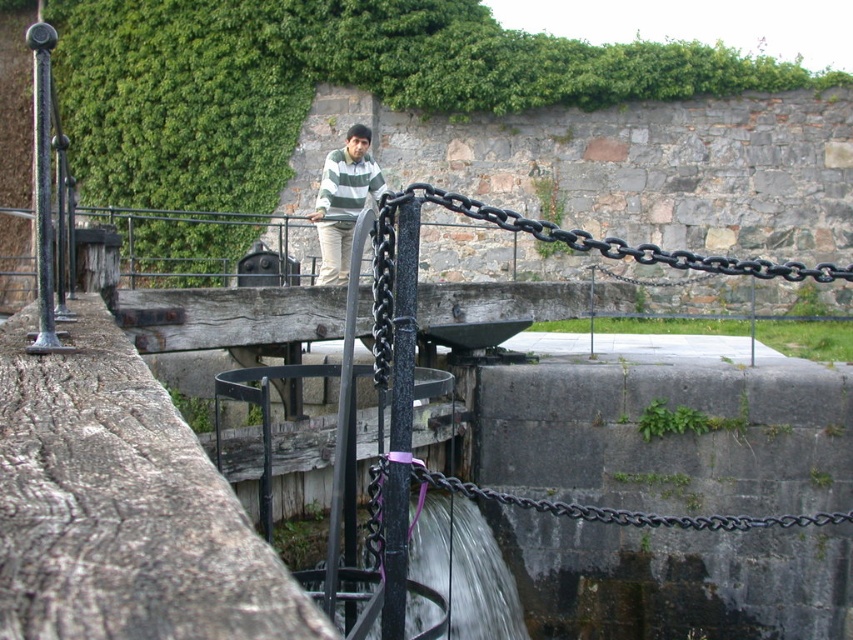
Between black metal chain at upper center and striped sweater at center, which one has more height?

black metal chain at upper center

Does black metal chain at upper center appear over striped sweater at center?

Actually, black metal chain at upper center is below striped sweater at center.

Which is in front, point (660, 260) or point (318, 284)?

Point (660, 260) is more forward.

The width and height of the screenshot is (853, 640). In order to click on black metal chain at upper center in this screenshot , I will do `click(624, 243)`.

Does striped sweater at center have a lesser height compared to black metal chain at lower center?

No, striped sweater at center is not shorter than black metal chain at lower center.

This screenshot has width=853, height=640. I want to click on striped sweater at center, so 343,200.

Is black metal chain at upper center to the right of black metal chain at lower center from the viewer's perspective?

Indeed, black metal chain at upper center is positioned on the right side of black metal chain at lower center.

What do you see at coordinates (624, 243) in the screenshot?
I see `black metal chain at upper center` at bounding box center [624, 243].

Identify the location of black metal chain at upper center. (624, 243).